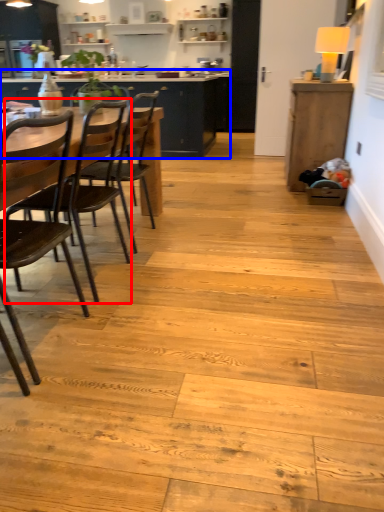
Question: Among these objects, which one is farthest to the camera, chair (highlighted by a red box) or cabinetry (highlighted by a blue box)?

Choices:
 (A) chair
 (B) cabinetry

Answer: (B)